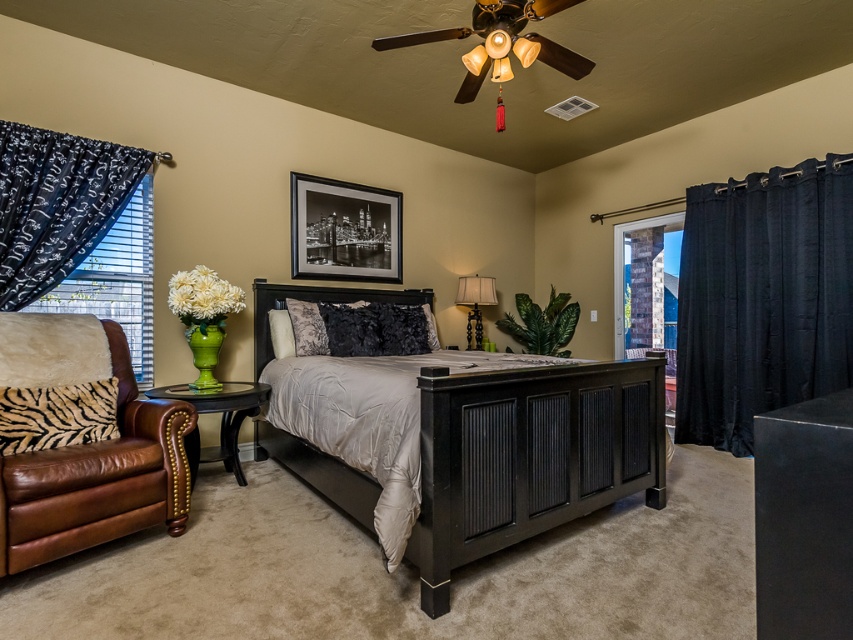
Question: Does satin black bed at center appear under black matte dresser at center?

Choices:
 (A) no
 (B) yes

Answer: (B)

Question: Does satin black bed at center have a greater width compared to black fabric curtain at left?

Choices:
 (A) no
 (B) yes

Answer: (B)

Question: Estimate the real-world distances between objects in this image. Which object is closer to the clear glass window at right?

Choices:
 (A) brown leather armchair at lower left
 (B) black fabric curtain at left

Answer: (B)

Question: Which point is closer to the camera?

Choices:
 (A) satin black bed at center
 (B) black fabric curtain at left
 (C) matte black lamp at center
 (D) black matte dresser at center

Answer: (D)

Question: Is black velvet curtain at right positioned at the back of brown leather armchair at lower left?

Choices:
 (A) no
 (B) yes

Answer: (B)

Question: Which is farther from the matte black lamp at center?

Choices:
 (A) brown leather armchair at lower left
 (B) black fabric curtain at left
 (C) black sheer curtain at left
 (D) black matte dresser at center

Answer: (D)